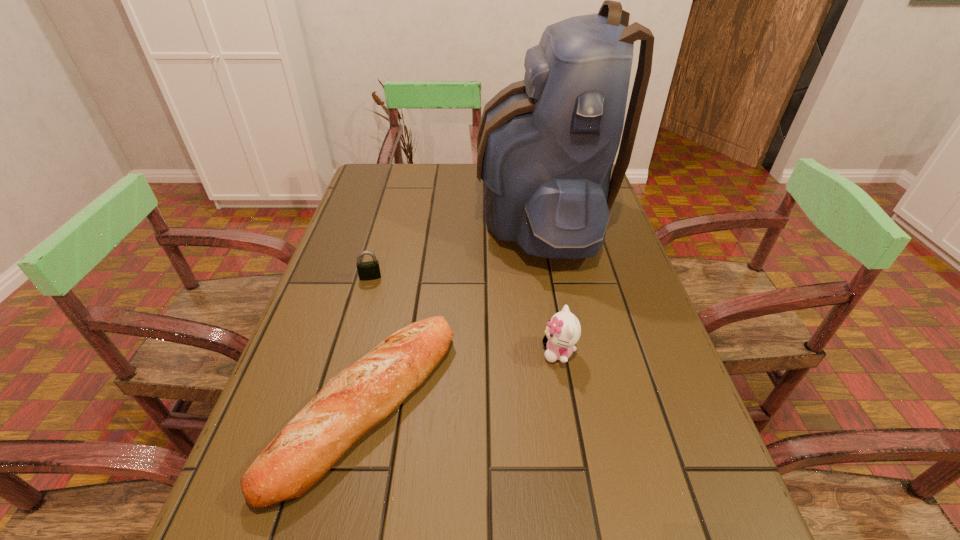
Locate an element on the screen. backpack is located at coordinates (546, 145).

You are a GUI agent. You are given a task and a screenshot of the screen. Output one action in this format:
    pyautogui.click(x=<x>, y=<y>)
    Task: Click on the third shortest object
    The height and width of the screenshot is (540, 960).
    Given the screenshot: What is the action you would take?
    click(563, 331)

The width and height of the screenshot is (960, 540). Identify the location of baguet. (353, 402).

Where is `padlock`? The height and width of the screenshot is (540, 960). padlock is located at coordinates (370, 270).

Where is `free point located 0.110m at the front pocket of the backpack`? This screenshot has height=540, width=960. free point located 0.110m at the front pocket of the backpack is located at coordinates (440, 215).

Find the location of a particular element. free location located at the front pocket of the backpack is located at coordinates (430, 215).

The height and width of the screenshot is (540, 960). Identify the location of vacant area situated at the front pocket of the backpack. (348, 215).

Find the location of a particular element. free space located on the front-facing side of the second tallest object is located at coordinates [373, 352].

What are the coordinates of `vacant space located 0.190m on the front-facing side of the second tallest object` in the screenshot? It's located at (450, 352).

Identify the location of vacant space located on the front-facing side of the second tallest object. (474, 352).